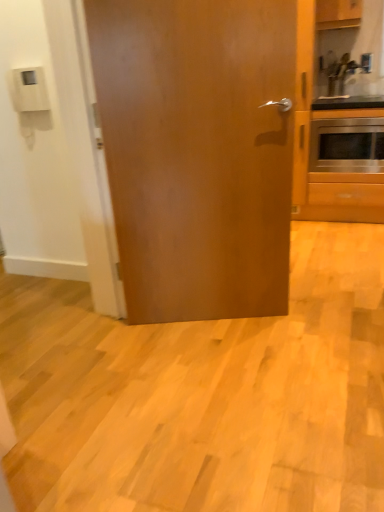
Locate an element on the screen. free space to the left of glossy wood door at center is located at coordinates (150, 346).